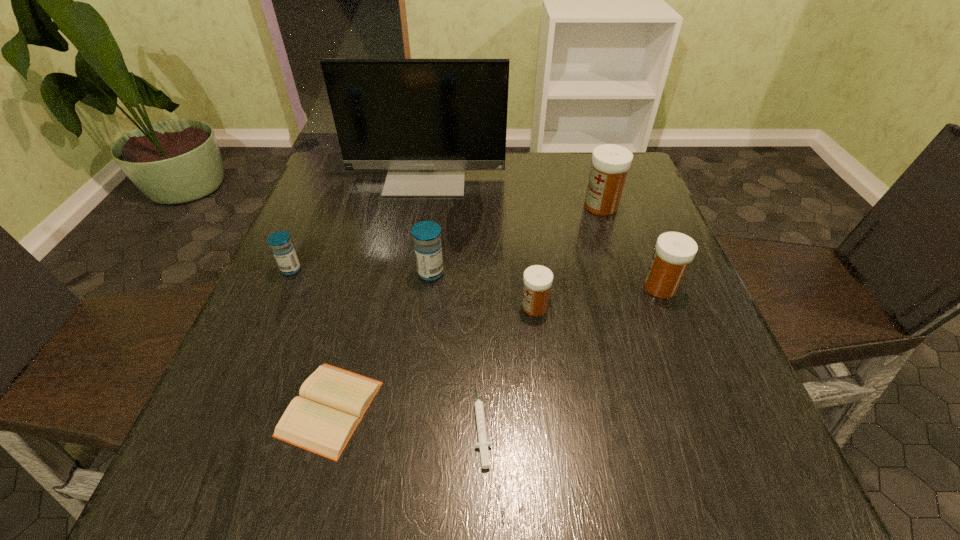
The width and height of the screenshot is (960, 540). Identify the location of free space in the image that satisfies the following two spatial constraints: 1. on the screen of the computer monitor; 2. on the left side of the bigger blue medicine. (411, 273).

Locate an element on the screen. The image size is (960, 540). free spot that satisfies the following two spatial constraints: 1. on the screen of the tallest object; 2. on the left side of the farthest white medicine is located at coordinates (421, 206).

The image size is (960, 540). I want to click on vacant area in the image that satisfies the following two spatial constraints: 1. on the back side of the smaller blue medicine; 2. on the left side of the farthest white medicine, so click(x=319, y=206).

Locate an element on the screen. free space that satisfies the following two spatial constraints: 1. on the front side of the second tallest object; 2. on the right side of the second biggest white medicine is located at coordinates (628, 287).